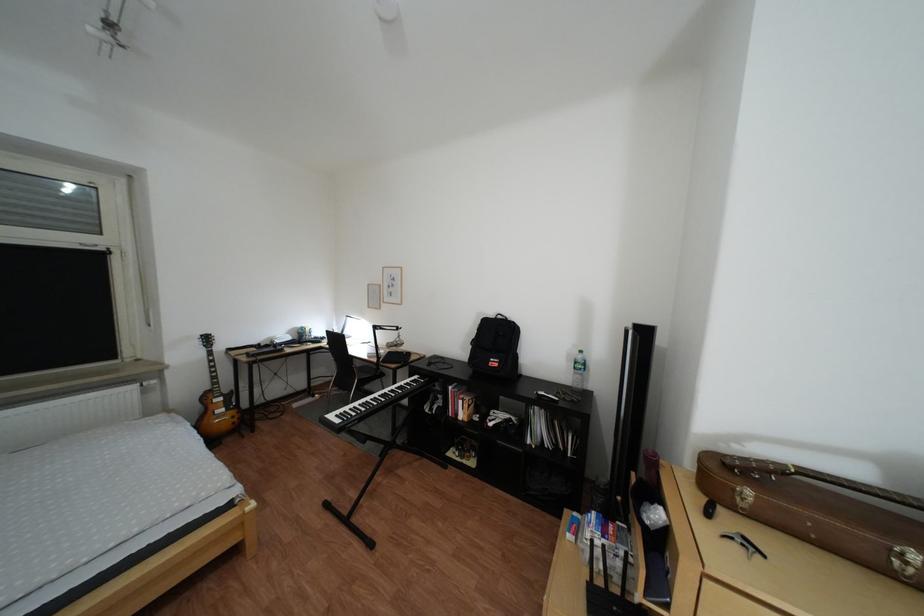
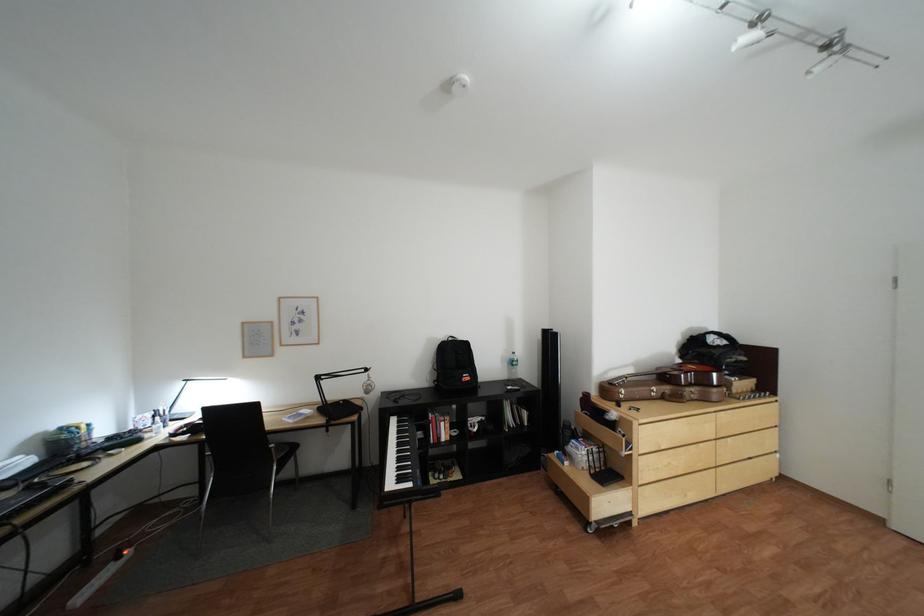
Find the pixel in the second image that matches pixel 515 318 in the first image.

(466, 339)